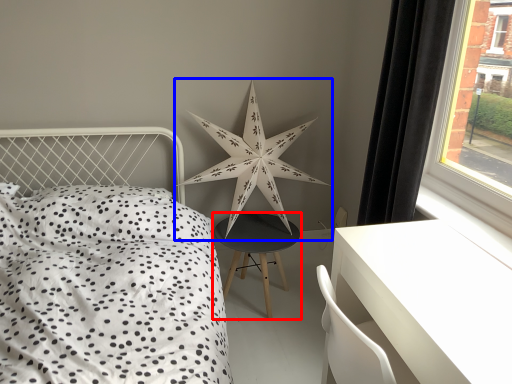
Question: Which object is closer to the camera taking this photo, nightstand (highlighted by a red box) or star (highlighted by a blue box)?

Choices:
 (A) nightstand
 (B) star

Answer: (B)